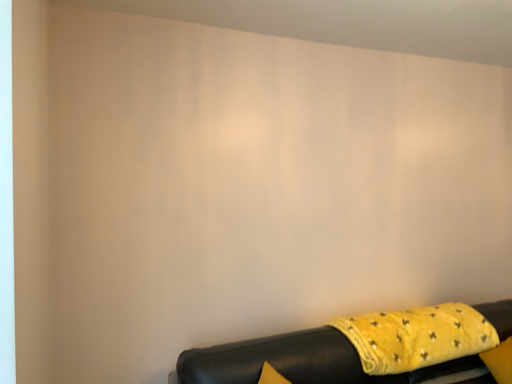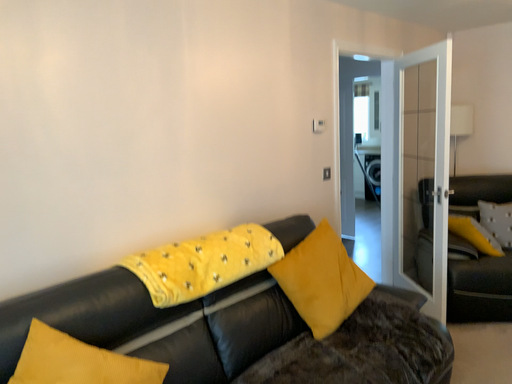
Question: How did the camera likely rotate when shooting the video?

Choices:
 (A) rotated downward
 (B) rotated upward

Answer: (A)